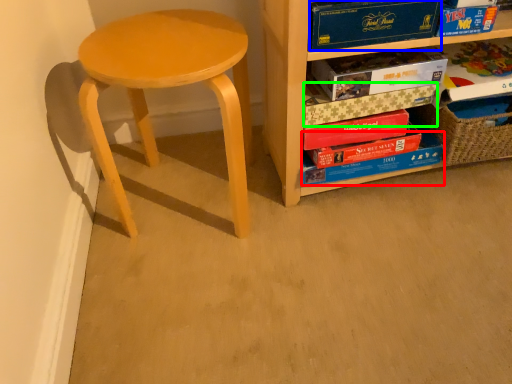
Question: Based on their relative distances, which object is farther from paperback book (highlighted by a red box)? Choose from paperback book (highlighted by a blue box) and paperback book (highlighted by a green box).

Choices:
 (A) paperback book
 (B) paperback book

Answer: (A)